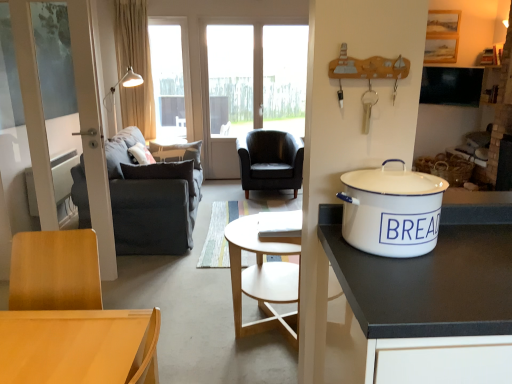
Question: Is black leather chair at center taller than dark gray fabric couch at left?

Choices:
 (A) yes
 (B) no

Answer: (B)

Question: Can you confirm if black leather chair at center is thinner than dark gray fabric couch at left?

Choices:
 (A) no
 (B) yes

Answer: (B)

Question: From a real-world perspective, is black leather chair at center positioned over dark gray fabric couch at left based on gravity?

Choices:
 (A) yes
 (B) no

Answer: (B)

Question: From the image's perspective, is black leather chair at center on top of dark gray fabric couch at left?

Choices:
 (A) yes
 (B) no

Answer: (A)

Question: Is black leather chair at center positioned in front of dark gray fabric couch at left?

Choices:
 (A) yes
 (B) no

Answer: (B)

Question: Is black leather chair at center not near dark gray fabric couch at left?

Choices:
 (A) no
 (B) yes

Answer: (B)

Question: Considering the relative positions of dark gray fabric couch at left and transparent glass window at upper center in the image provided, is dark gray fabric couch at left behind transparent glass window at upper center?

Choices:
 (A) no
 (B) yes

Answer: (A)

Question: Is dark gray fabric couch at left positioned beyond the bounds of transparent glass window at upper center?

Choices:
 (A) no
 (B) yes

Answer: (B)

Question: Does dark gray fabric couch at left turn towards transparent glass window at upper center?

Choices:
 (A) yes
 (B) no

Answer: (B)

Question: From a real-world perspective, is dark gray fabric couch at left on transparent glass window at upper center?

Choices:
 (A) no
 (B) yes

Answer: (A)

Question: Can you confirm if dark gray fabric couch at left is positioned to the left of transparent glass window at upper center?

Choices:
 (A) no
 (B) yes

Answer: (A)

Question: Is dark gray fabric couch at left wider than transparent glass window at upper center?

Choices:
 (A) no
 (B) yes

Answer: (B)

Question: Can you confirm if black leather chair at center is bigger than beige fabric curtain at upper left?

Choices:
 (A) yes
 (B) no

Answer: (A)